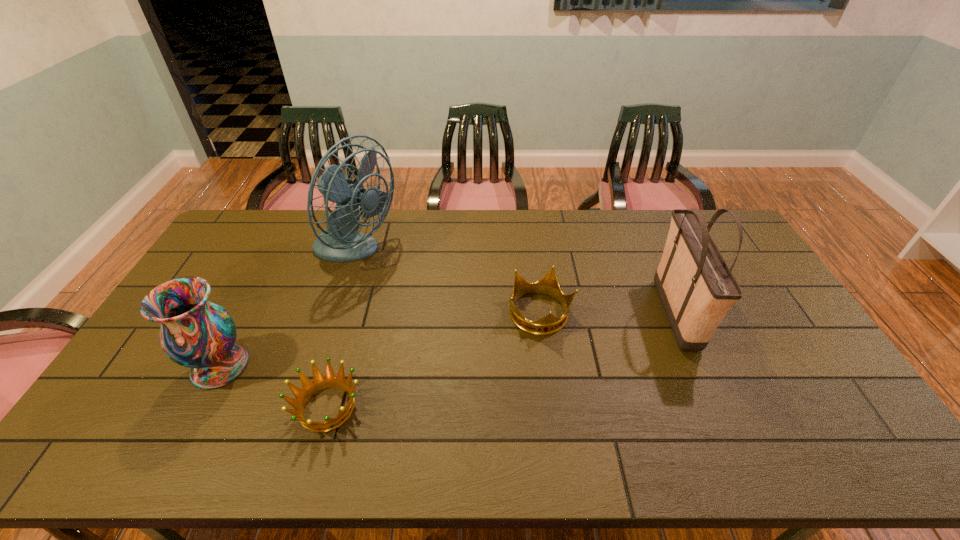
Identify the location of free space between the taller crown and the rightmost object. This screenshot has height=540, width=960. (608, 314).

This screenshot has width=960, height=540. In order to click on object that ranks as the third closest to the nearer crown in this screenshot , I will do `click(548, 285)`.

Select which object is the fourth closest to the vase. Please provide its 2D coordinates. Your answer should be formatted as a tuple, i.e. [(x, y)], where the tuple contains the x and y coordinates of a point satisfying the conditions above.

[(696, 287)]

Where is `free region that satisfies the following two spatial constraints: 1. on the back side of the fourth object from left to right; 2. on the right side of the leftmost object`? The image size is (960, 540). free region that satisfies the following two spatial constraints: 1. on the back side of the fourth object from left to right; 2. on the right side of the leftmost object is located at coordinates (247, 314).

Where is `free space that satisfies the following two spatial constraints: 1. in front of the right crown to blow air; 2. on the left side of the tallest object`? free space that satisfies the following two spatial constraints: 1. in front of the right crown to blow air; 2. on the left side of the tallest object is located at coordinates (335, 314).

Identify the location of free space that satisfies the following two spatial constraints: 1. in front of the fan to blow air; 2. on the back side of the taller crown. The height and width of the screenshot is (540, 960). (335, 314).